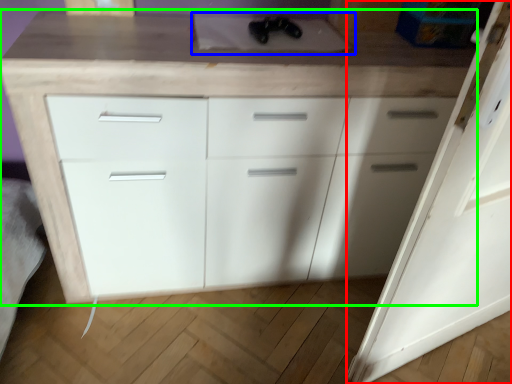
Question: Which object is positioned closest to door (highlighted by a red box)? Select from sink (highlighted by a blue box) and chest of drawers (highlighted by a green box).

Choices:
 (A) sink
 (B) chest of drawers

Answer: (B)